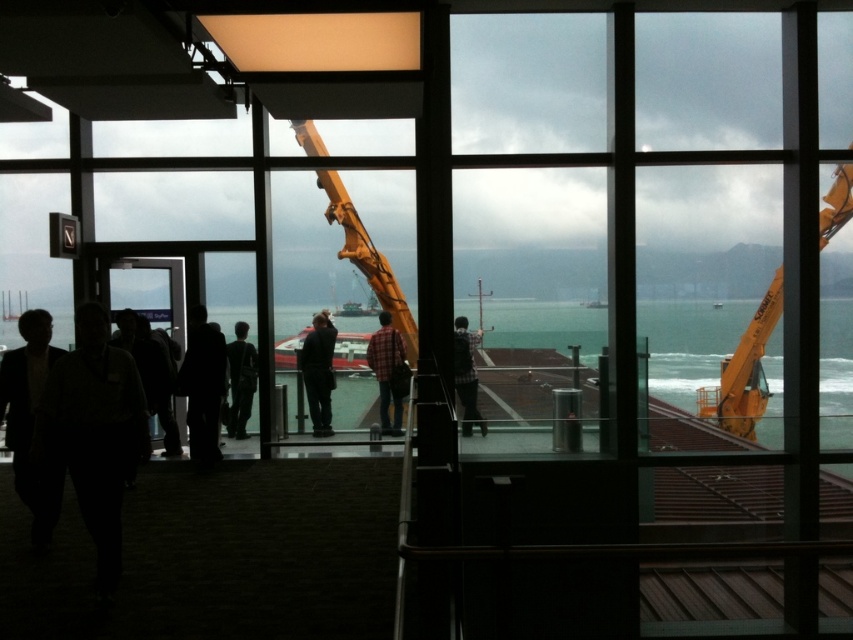
You are a photographer standing in the observation deck. You notice the clear water at center and the plaid shirt at center in the scene. Which object is higher in the image?

The clear water at center is above the plaid shirt at center, so it is higher in the image.

You are a photographer trying to capture a person standing at the center of the observation deck. The person is wearing a plaid fabric shirt at center and dark gray pants at center. Can you tell me which clothing item is covering the other?

The plaid fabric shirt at center is positioned over the dark gray pants at center, so the shirt is covering the pants.